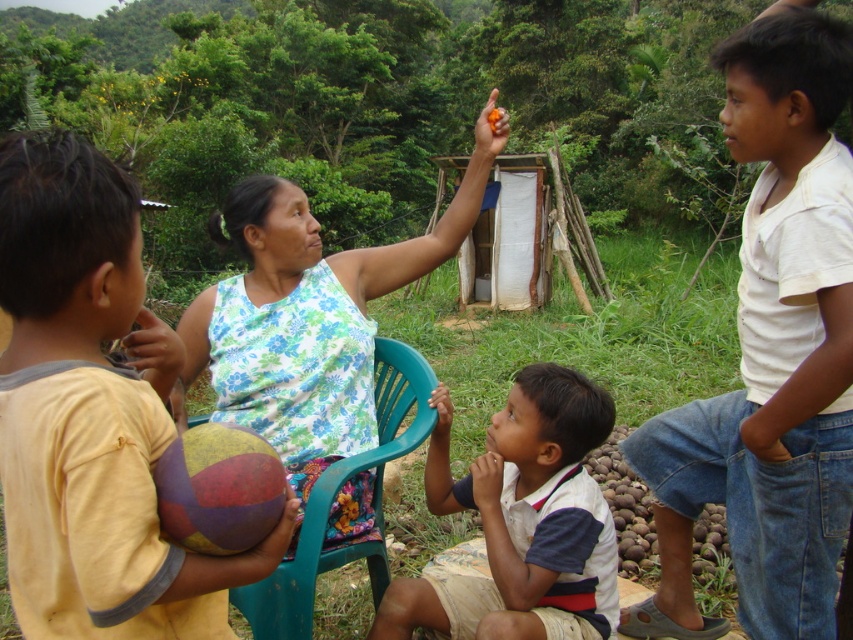
Is yellow cotton shirt at left closer to camera compared to white cotton shirt at center?

Yes, yellow cotton shirt at left is in front of white cotton shirt at center.

Is point (86, 353) closer to viewer compared to point (573, 595)?

That is True.

Which is in front, point (196, 620) or point (421, 604)?

Positioned in front is point (196, 620).

You are a GUI agent. You are given a task and a screenshot of the screen. Output one action in this format:
    pyautogui.click(x=<x>, y=<y>)
    Task: Click on the yellow cotton shirt at left
    
    Given the screenshot: What is the action you would take?
    pyautogui.click(x=91, y=412)

Does white cotton shirt at right lie in front of teal plastic chair at center?

That is True.

Which of these two, white cotton shirt at right or teal plastic chair at center, stands taller?

white cotton shirt at right

Describe the element at coordinates (770, 353) in the screenshot. This screenshot has width=853, height=640. I see `white cotton shirt at right` at that location.

Where is `white cotton shirt at right`? white cotton shirt at right is located at coordinates (770, 353).

Does white cotton shirt at right appear on the right side of floral fabric dress at center?

Correct, you'll find white cotton shirt at right to the right of floral fabric dress at center.

Is white cotton shirt at right closer to camera compared to floral fabric dress at center?

No, it is behind floral fabric dress at center.

This screenshot has height=640, width=853. Find the location of `white cotton shirt at right`. white cotton shirt at right is located at coordinates (770, 353).